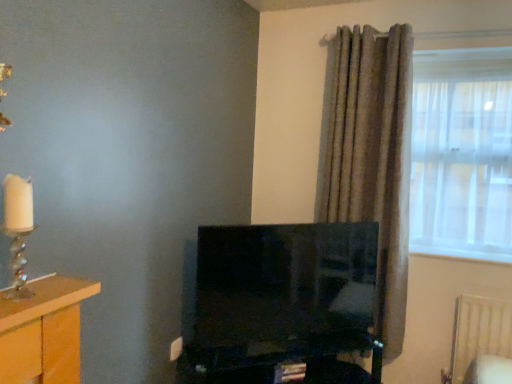
Question: Is textured gray curtain at right spatially inside wooden table at left, or outside of it?

Choices:
 (A) outside
 (B) inside

Answer: (A)

Question: From the image's perspective, is textured gray curtain at right located above or below wooden table at left?

Choices:
 (A) above
 (B) below

Answer: (A)

Question: Estimate the real-world distances between objects in this image. Which object is closer to the black glossy computer desk at center?

Choices:
 (A) wooden table at left
 (B) translucent glass candle holder at left
 (C) matte black tv at center
 (D) translucent fabric window at right
 (E) textured gray curtain at right

Answer: (C)

Question: Which object is the closest to the translucent glass candle holder at left?

Choices:
 (A) textured gray curtain at right
 (B) translucent fabric window at right
 (C) black glossy computer desk at center
 (D) matte black tv at center
 (E) wooden table at left

Answer: (E)